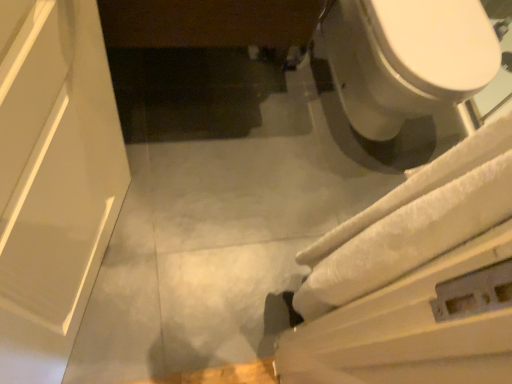
Question: Is white glossy toilet at upper right to the left or to the right of white textured bath towel at right in the image?

Choices:
 (A) left
 (B) right

Answer: (B)

Question: From a real-world perspective, is white glossy toilet at upper right above or below white textured bath towel at right?

Choices:
 (A) above
 (B) below

Answer: (B)

Question: Considering the positions of point (417, 34) and point (457, 206), is point (417, 34) closer or farther from the camera than point (457, 206)?

Choices:
 (A) farther
 (B) closer

Answer: (A)

Question: Is point (458, 208) positioned closer to the camera than point (426, 91)?

Choices:
 (A) farther
 (B) closer

Answer: (B)

Question: From the image's perspective, relative to white glossy toilet at upper right, is white textured bath towel at right above or below?

Choices:
 (A) above
 (B) below

Answer: (B)

Question: Looking at their shapes, would you say white textured bath towel at right is wider or thinner than white glossy toilet at upper right?

Choices:
 (A) wide
 (B) thin

Answer: (B)

Question: From a real-world perspective, is white textured bath towel at right above or below white glossy toilet at upper right?

Choices:
 (A) below
 (B) above

Answer: (B)